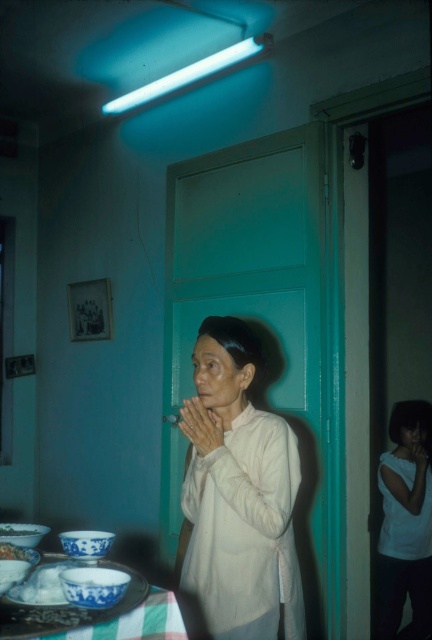
Question: Can you confirm if white cotton shirt at center is positioned to the right of blue porcelain bowl at lower left?

Choices:
 (A) no
 (B) yes

Answer: (B)

Question: Which object is farther from the camera taking this photo?

Choices:
 (A) white cotton shirt at center
 (B) white porcelain bowl at lower left
 (C) blue porcelain bowl at lower left
 (D) white matte shirt at center

Answer: (A)

Question: Which object is farther from the camera taking this photo?

Choices:
 (A) white porcelain bowl at lower left
 (B) white matte shirt at center

Answer: (A)

Question: In this image, where is white matte shirt at center located relative to white cotton shirt at center?

Choices:
 (A) below
 (B) above

Answer: (B)

Question: Does white matte shirt at center appear on the left side of blue porcelain bowl at lower left?

Choices:
 (A) no
 (B) yes

Answer: (A)

Question: Which object is positioned farthest from the white matte shirt at center?

Choices:
 (A) blue porcelain bowl at lower left
 (B) white cotton shirt at center

Answer: (B)